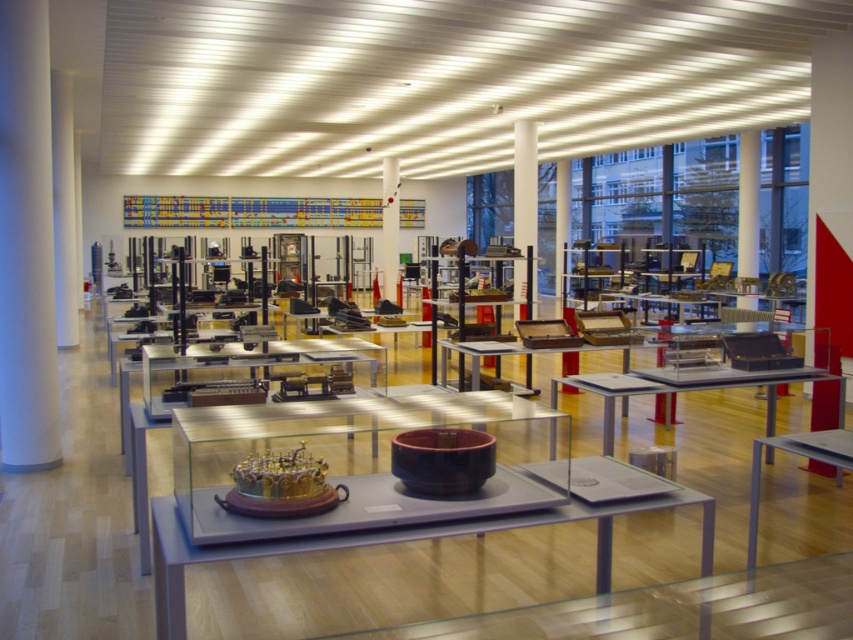
You are an art curator planning to place a new sculpture between the metallic silver table at center and the white glossy pillar at center. Based on the current arrangement, which object should the sculpture be placed to the left of?

The sculpture should be placed to the left of the white glossy pillar at center because the metallic silver table at center is on its right side.

You are standing in the exhibition space and want to take a photo of the wooden table at center and the white glossy pillar at center. Which object should you focus on first if you want to capture both in a single frame without moving the camera?

You should focus on the wooden table at center first because it is closer to the viewer than the white glossy pillar at center, so keeping it in focus will ensure both are sharp in the photo.

You are an art curator planning to move a large sculpture from the entrance to the matte gray table at center and the metallic silver table at center. Based on their positions, which table should you place it on to ensure it is visible from the entrance?

The metallic silver table at center is above the matte gray table at center, so placing the sculpture on the metallic silver table at center will make it more visible from the entrance.